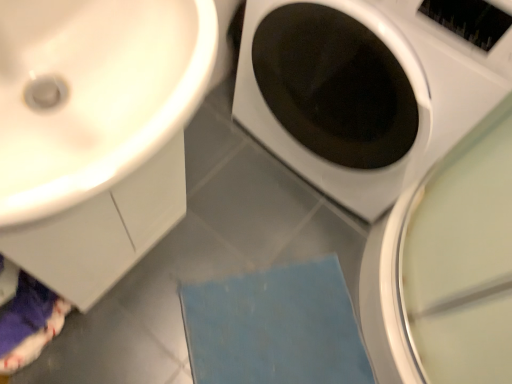
Describe the element at coordinates (96, 92) in the screenshot. I see `white glossy sink at upper left` at that location.

The height and width of the screenshot is (384, 512). What are the coordinates of `blue fabric bath mat at lower center` in the screenshot? It's located at [275, 327].

The width and height of the screenshot is (512, 384). In order to click on white glossy sink at upper left in this screenshot , I will do `click(96, 92)`.

Is white glossy washing machine at center facing away from blue fabric bath mat at lower center?

No, white glossy washing machine at center is not facing the opposite direction of blue fabric bath mat at lower center.

From the image's perspective, which is above, white glossy washing machine at center or blue fabric bath mat at lower center?

white glossy washing machine at center, from the image's perspective.

Can you confirm if white glossy washing machine at center is bigger than blue fabric bath mat at lower center?

Correct, white glossy washing machine at center is larger in size than blue fabric bath mat at lower center.

Considering the sizes of objects white glossy washing machine at center and blue fabric bath mat at lower center in the image provided, who is wider, white glossy washing machine at center or blue fabric bath mat at lower center?

With larger width is white glossy washing machine at center.

Consider the image. Can we say white glossy sink at upper left lies outside white glossy washing machine at center?

That's correct, white glossy sink at upper left is outside of white glossy washing machine at center.

Measure the distance from white glossy sink at upper left to white glossy washing machine at center.

white glossy sink at upper left is 19.67 inches from white glossy washing machine at center.

Considering the sizes of white glossy sink at upper left and white glossy washing machine at center in the image, is white glossy sink at upper left taller or shorter than white glossy washing machine at center?

Considering their sizes, white glossy sink at upper left has less height than white glossy washing machine at center.

Can you tell me how much white glossy sink at upper left and white glossy washing machine at center differ in facing direction?

white glossy sink at upper left and white glossy washing machine at center are facing 88.1 degrees away from each other.

Is the position of white glossy sink at upper left more distant than that of blue fabric bath mat at lower center?

No.

Does white glossy sink at upper left appear on the left side of blue fabric bath mat at lower center?

Yes, white glossy sink at upper left is to the left of blue fabric bath mat at lower center.

Considering the sizes of white glossy sink at upper left and blue fabric bath mat at lower center in the image, is white glossy sink at upper left bigger or smaller than blue fabric bath mat at lower center?

Considering their sizes, white glossy sink at upper left takes up more space than blue fabric bath mat at lower center.

Is white glossy sink at upper left next to blue fabric bath mat at lower center?

No, white glossy sink at upper left is not touching blue fabric bath mat at lower center.

From the picture: Is white glossy washing machine at center closer to camera compared to white glossy sink at upper left?

No, white glossy washing machine at center is behind white glossy sink at upper left.

From the image's perspective, would you say white glossy washing machine at center is positioned over white glossy sink at upper left?

Yes.

Is white glossy washing machine at center not close to white glossy sink at upper left?

Actually, white glossy washing machine at center and white glossy sink at upper left are a little close together.

From the image's perspective, who appears lower, blue fabric bath mat at lower center or white glossy sink at upper left?

From the image's view, blue fabric bath mat at lower center is below.

Considering the relative sizes of blue fabric bath mat at lower center and white glossy sink at upper left in the image provided, is blue fabric bath mat at lower center taller than white glossy sink at upper left?

No, blue fabric bath mat at lower center is not taller than white glossy sink at upper left.

Measure the distance between blue fabric bath mat at lower center and white glossy sink at upper left.

They are 32.12 inches apart.

How different are the orientations of blue fabric bath mat at lower center and white glossy washing machine at center in degrees?

They differ by 39.1 degrees in their facing directions.

Locate an element on the screen. washing machine located in front of the blue fabric bath mat at lower center is located at coordinates (369, 87).

From the image's perspective, between blue fabric bath mat at lower center and white glossy washing machine at center, which one is located above?

white glossy washing machine at center is shown above in the image.

The height and width of the screenshot is (384, 512). Identify the location of washing machine lying on the right of blue fabric bath mat at lower center. (369, 87).

Locate an element on the screen. sink that is below the white glossy washing machine at center (from the image's perspective) is located at coordinates (96, 92).

When comparing their distances from white glossy washing machine at center, does blue fabric bath mat at lower center or white glossy sink at upper left seem further?

Among the two, blue fabric bath mat at lower center is located further to white glossy washing machine at center.

Based on their spatial positions, is white glossy sink at upper left or white glossy washing machine at center further from blue fabric bath mat at lower center?

white glossy sink at upper left is further to blue fabric bath mat at lower center.

Which object lies nearer to the anchor point blue fabric bath mat at lower center, white glossy washing machine at center or white glossy sink at upper left?

white glossy washing machine at center lies closer to blue fabric bath mat at lower center than the other object.

Based on their spatial positions, is white glossy sink at upper left or blue fabric bath mat at lower center closer to white glossy washing machine at center?

Among the two, white glossy sink at upper left is located nearer to white glossy washing machine at center.

Which object lies nearer to the anchor point white glossy sink at upper left, blue fabric bath mat at lower center or white glossy washing machine at center?

white glossy washing machine at center.

Looking at the image, which one is located closer to white glossy sink at upper left, white glossy washing machine at center or blue fabric bath mat at lower center?

white glossy washing machine at center.

I want to click on sink between white glossy washing machine at center and blue fabric bath mat at lower center from top to bottom, so click(96, 92).